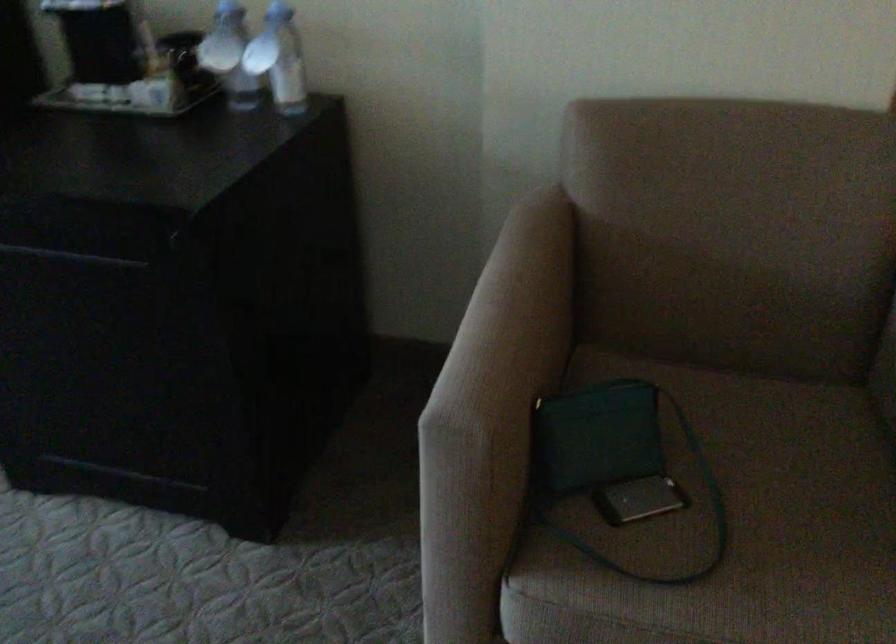
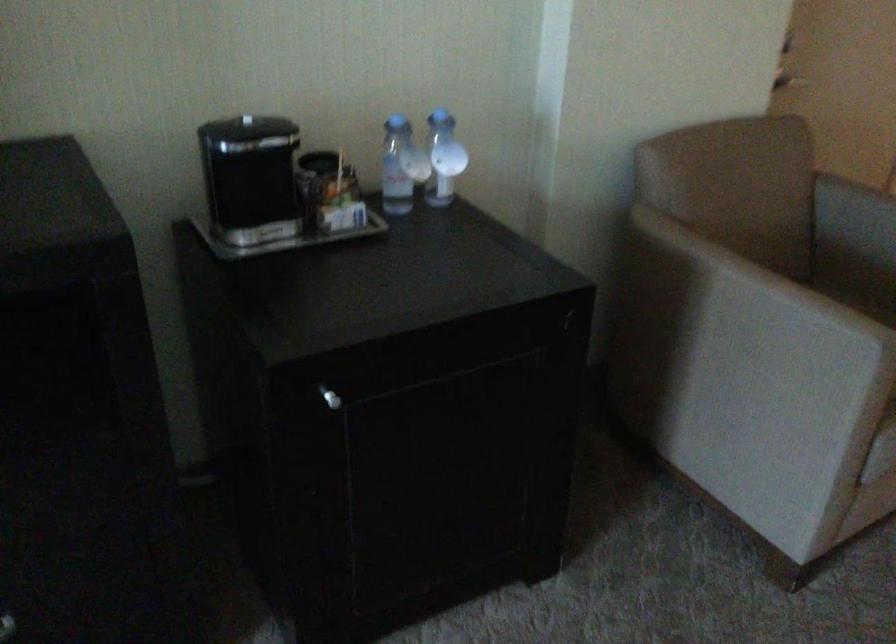
Where in the second image is the point corresponding to point (471, 346) from the first image?

(739, 319)